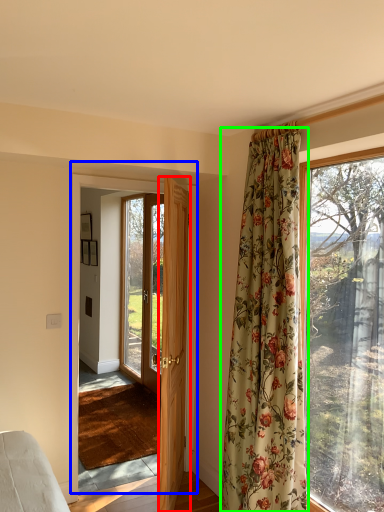
Question: Based on their relative distances, which object is nearer to door (highlighted by a red box)? Choose from door (highlighted by a blue box) and curtain (highlighted by a green box).

Choices:
 (A) door
 (B) curtain

Answer: (B)